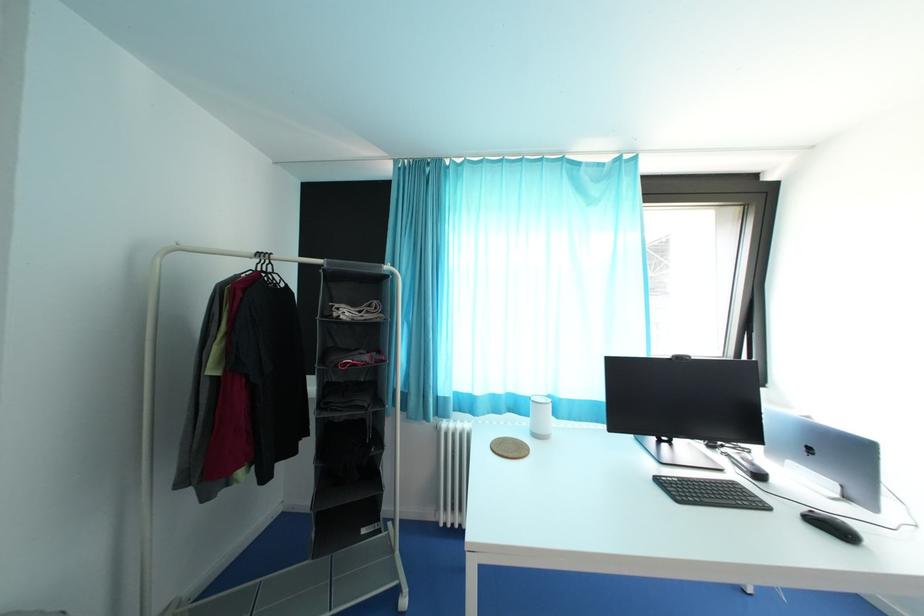
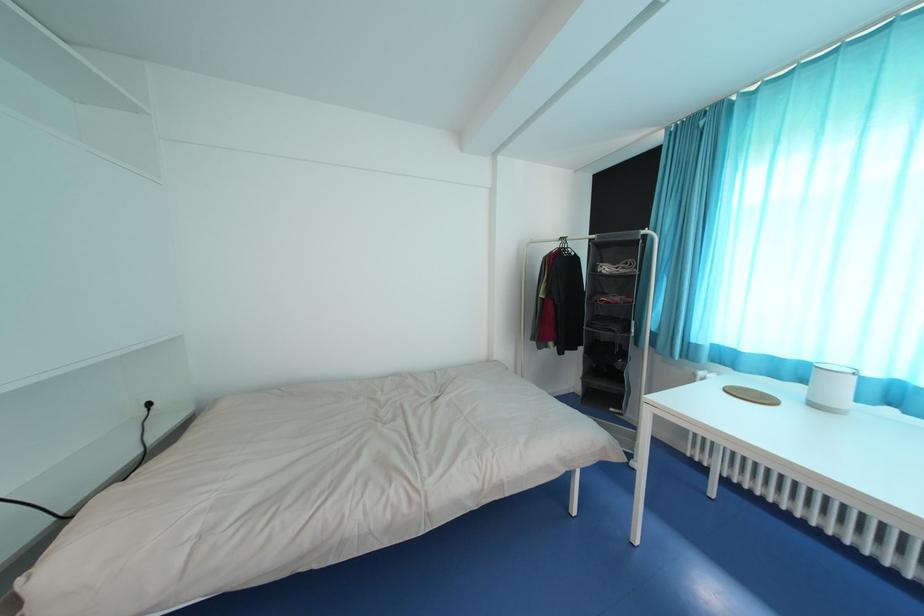
Question: The first image is from the beginning of the video and the second image is from the end. How did the camera likely rotate when shooting the video?

Choices:
 (A) Left
 (B) Right
 (C) Up
 (D) Down

Answer: (A)